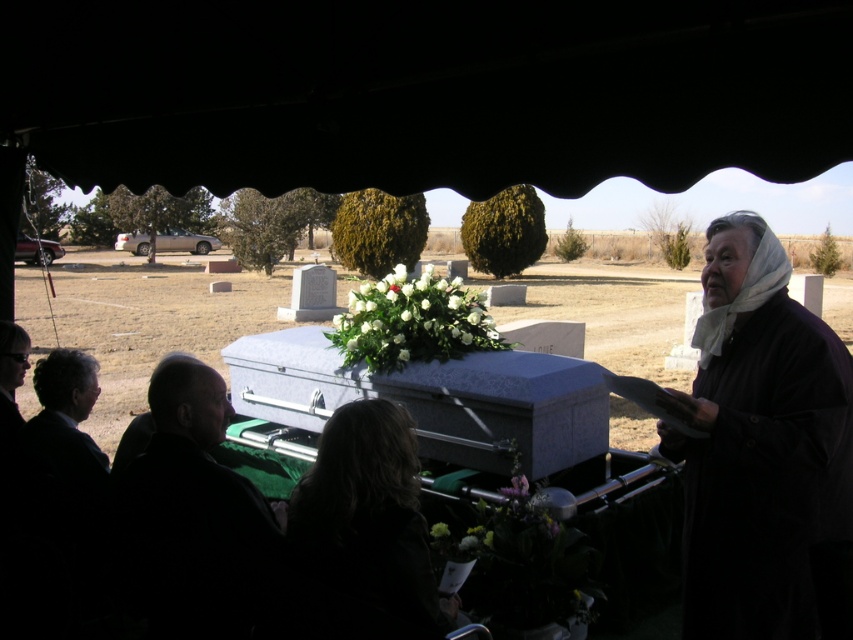
Who is more forward, (x=352, y=316) or (x=444, y=528)?

Point (x=444, y=528)

Consider the image. Between white matte floral arrangement at center and green matte flower at center, which one has less height?

With less height is green matte flower at center.

Does point (427, 316) lie in front of point (437, 528)?

No, (427, 316) is further to viewer.

Locate an element on the screen. white matte floral arrangement at center is located at coordinates (412, 321).

Is dark brown hair at lower center shorter than white matte floral arrangement at center?

Yes.

Who is positioned more to the left, dark brown hair at lower center or white matte floral arrangement at center?

Positioned to the left is white matte floral arrangement at center.

Is point (300, 582) positioned behind point (424, 314)?

No, it is in front of (424, 314).

Where is `dark brown hair at lower center`? dark brown hair at lower center is located at coordinates point(364,531).

Does dark brown hair at lower center appear under green matte flower at center?

Actually, dark brown hair at lower center is above green matte flower at center.

Who is more forward, (x=438, y=621) or (x=440, y=524)?

Point (x=438, y=621) is more forward.

Identify the location of dark brown hair at lower center. [364, 531].